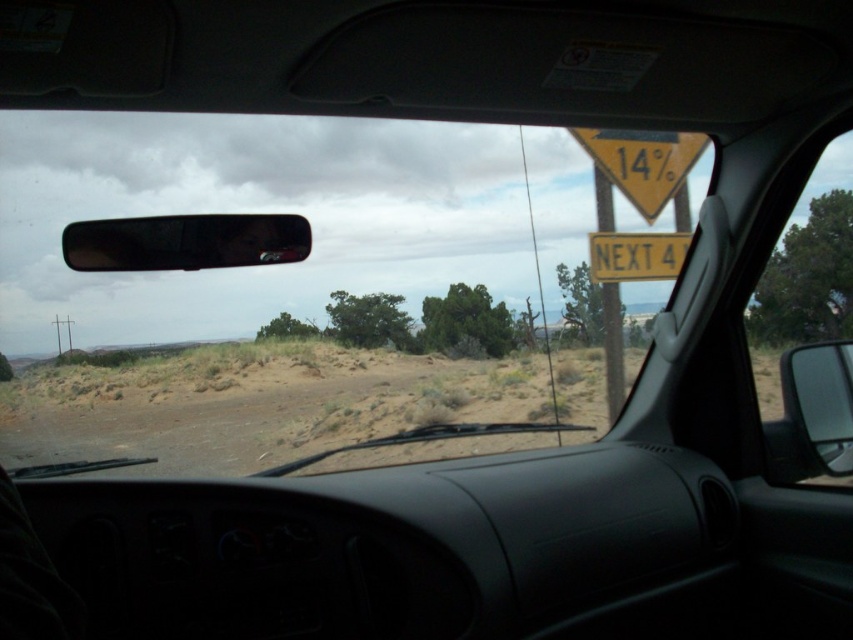
You are driving in a desert and see two points on the road ahead. The first point is at coordinates point (x=656, y=145) and the second is at point (x=606, y=314). Which point is closer to your current position?

Point (x=656, y=145) is in front of point (x=606, y=314), so it is closer to your current position.